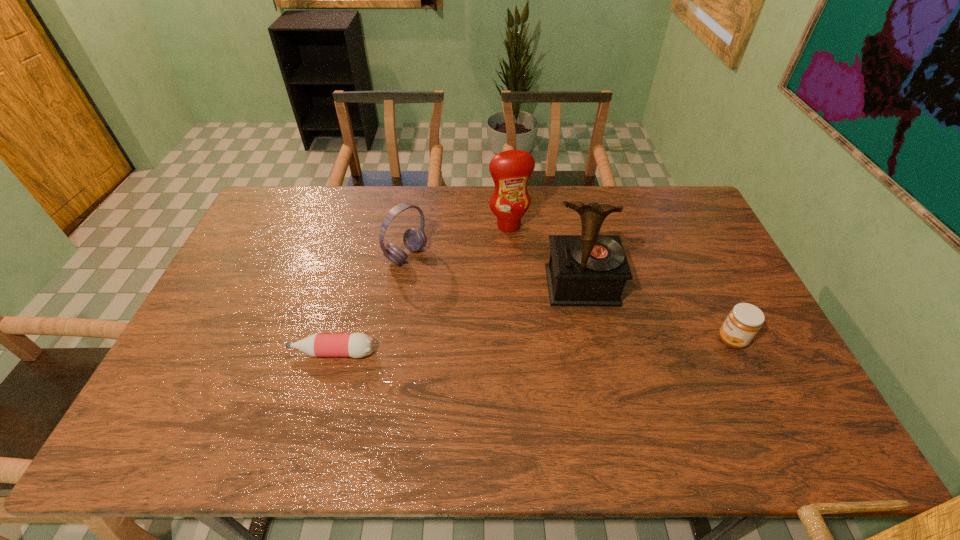
At what (x,y) coordinates should I click in order to perform the action: click on free space between the rightmost object and the bottle. Please return your answer as a coordinate pair (x, y). Image resolution: width=960 pixels, height=540 pixels. Looking at the image, I should click on (532, 346).

I want to click on empty space between the phonograph_record and the third shortest object, so click(494, 271).

Find the location of a particular element. The height and width of the screenshot is (540, 960). empty space between the shortest object and the second object from right to left is located at coordinates (457, 319).

Where is `free point between the tallest object and the farthest object`? free point between the tallest object and the farthest object is located at coordinates click(545, 255).

This screenshot has height=540, width=960. In order to click on free spot between the bottle and the rightmost object in this screenshot , I will do `click(532, 346)`.

Image resolution: width=960 pixels, height=540 pixels. I want to click on vacant space that's between the headset and the bottle, so click(x=370, y=304).

Where is `unoccupied position between the bottle and the phonograph_record`? The width and height of the screenshot is (960, 540). unoccupied position between the bottle and the phonograph_record is located at coordinates (457, 319).

This screenshot has height=540, width=960. I want to click on unoccupied area between the bottle and the second object from right to left, so click(x=457, y=319).

Image resolution: width=960 pixels, height=540 pixels. Find the location of `object that is the second closest to the bottle`. object that is the second closest to the bottle is located at coordinates (591, 270).

Locate which object is the third closest to the shortest object. Please provide its 2D coordinates. Your answer should be formatted as a tuple, i.e. [(x, y)], where the tuple contains the x and y coordinates of a point satisfying the conditions above.

[(510, 170)]